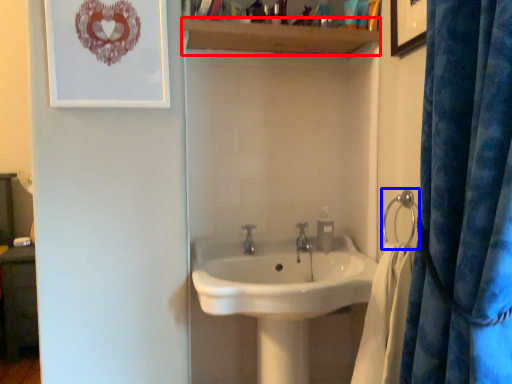
Question: Among these objects, which one is farthest to the camera, balustrade (highlighted by a red box) or shower (highlighted by a blue box)?

Choices:
 (A) balustrade
 (B) shower

Answer: (A)